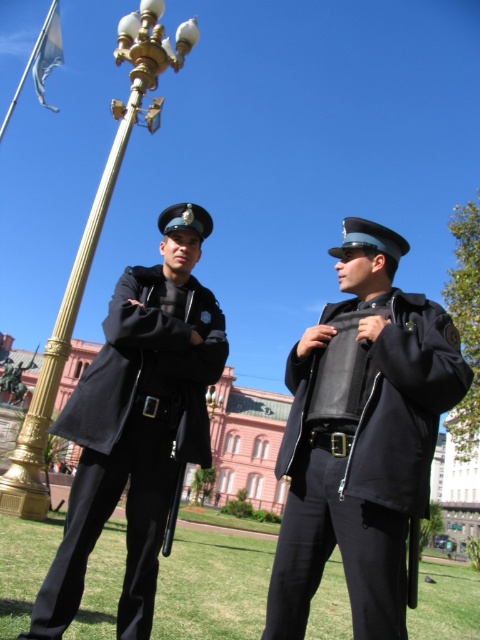
You are standing at the flagpole and want to walk to the lamppost. Which point should you pass through first, point (48, 632) or point (36, 72)?

Since point (48, 632) is in front of point (36, 72), you should pass through point (48, 632) first on your way to the lamppost.

You are a photographer positioned at the base of the gold polished metal flag pole at upper left. You want to take a photo of the matte black uniform at center without including the flag pole in the shot. Which direction should you move to achieve this?

You should move to the right of the gold polished metal flag pole at upper left to position yourself so that the matte black uniform at center is no longer blocked by the flag pole.